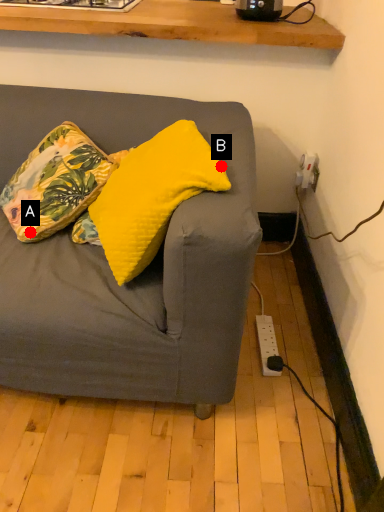
Question: Two points are circled on the image, labeled by A and B beside each circle. Which point is farther to the camera?

Choices:
 (A) A is further
 (B) B is further

Answer: (A)